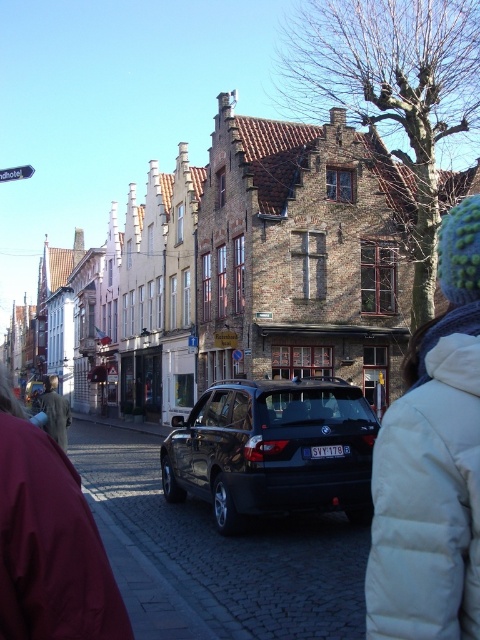
Question: Which of the following is the closest to the observer?

Choices:
 (A) (344, 492)
 (B) (8, 566)
 (C) (468, 579)

Answer: (B)

Question: Which point is farther to the camera?

Choices:
 (A) (195, 467)
 (B) (466, 632)

Answer: (A)

Question: Does maroon fabric jacket at lower left appear on the left side of light brown leather jacket at lower left?

Choices:
 (A) yes
 (B) no

Answer: (B)

Question: Can you confirm if glossy black car at center is positioned to the left of light brown leather jacket at lower left?

Choices:
 (A) no
 (B) yes

Answer: (A)

Question: Can you confirm if maroon fabric jacket at lower left is wider than light brown leather jacket at lower left?

Choices:
 (A) yes
 (B) no

Answer: (B)

Question: Which object appears farthest from the camera in this image?

Choices:
 (A) light brown leather jacket at lower left
 (B) glossy black car at center

Answer: (B)